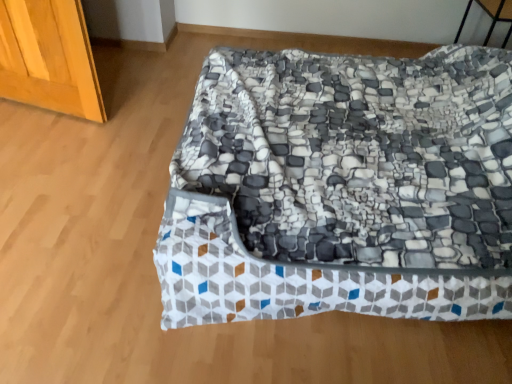
What do you see at coordinates (342, 188) in the screenshot? I see `textured fabric pet bed at center` at bounding box center [342, 188].

At what (x,y) coordinates should I click in order to perform the action: click on textured fabric pet bed at center. Please return your answer as a coordinate pair (x, y). Looking at the image, I should click on (342, 188).

Where is `textured fabric pet bed at center`? textured fabric pet bed at center is located at coordinates (342, 188).